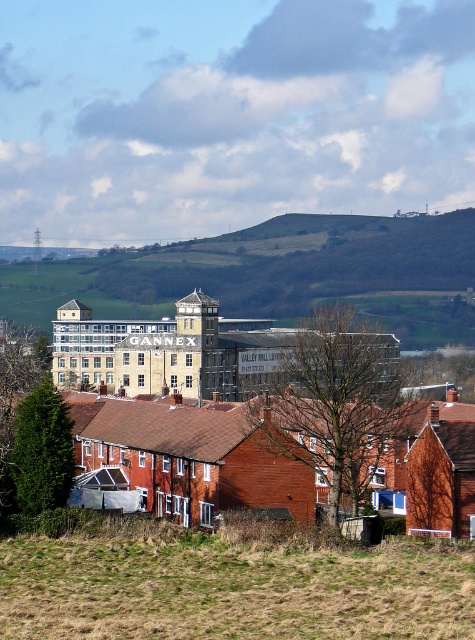
You are a photographer planning to capture the entire scene in one shot. You notice the yellow brick building at center and the bare branches at center. Which object should you adjust your camera angle to include first if you want to ensure both are fully visible?

The yellow brick building at center is above the bare branches at center, so you should adjust your camera angle to include the yellow brick building at center first, ensuring it is fully visible before framing the lower positioned bare branches at center.

You are standing in the middle of the grassy field in the rural landscape. You want to take a photo of the bare branches at center. Where should you position yourself to capture the branches in the center of your camera view?

To capture the bare branches at center in the center of your camera view, position yourself so that the branches are aligned with the center point of your camera lens, which corresponds to the coordinates mentioned in the description.